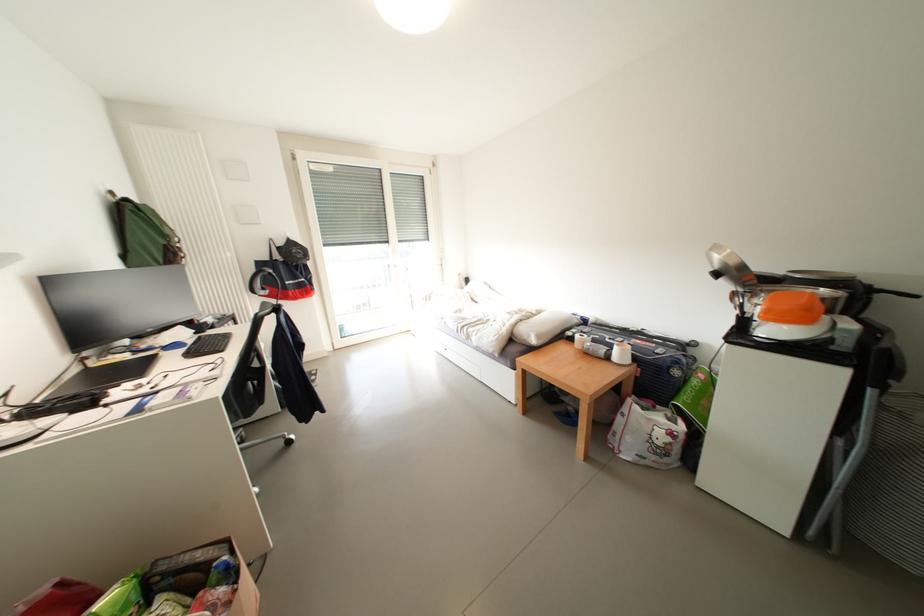
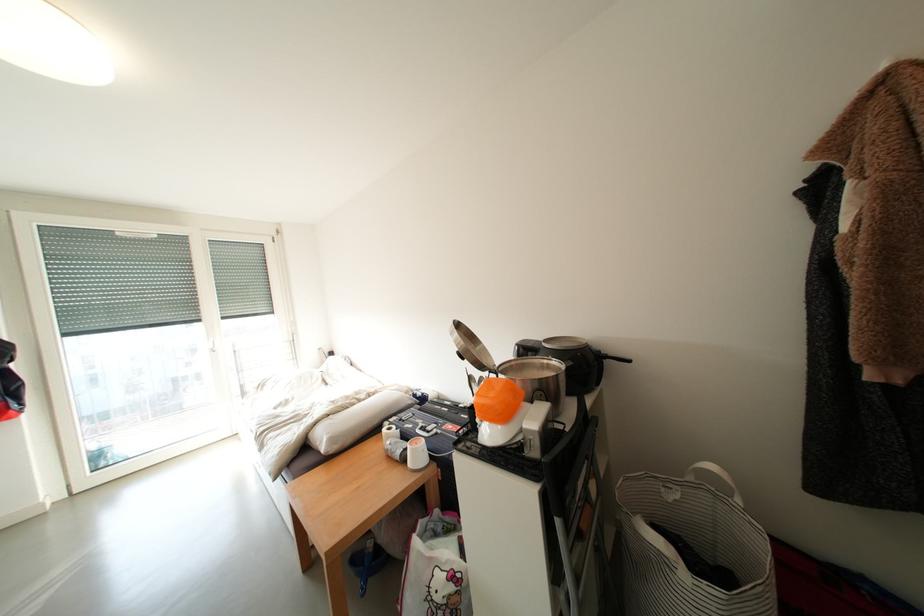
The point at (628,358) is marked in the first image. Where is the corresponding point in the second image?

(424, 456)